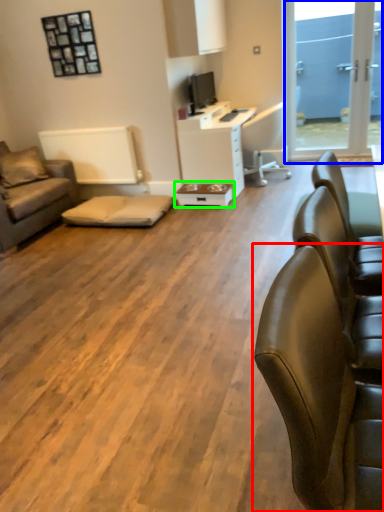
Question: Which is farther away from chair (highlighted by a red box)? window screen (highlighted by a blue box) or table (highlighted by a green box)?

Choices:
 (A) window screen
 (B) table

Answer: (A)